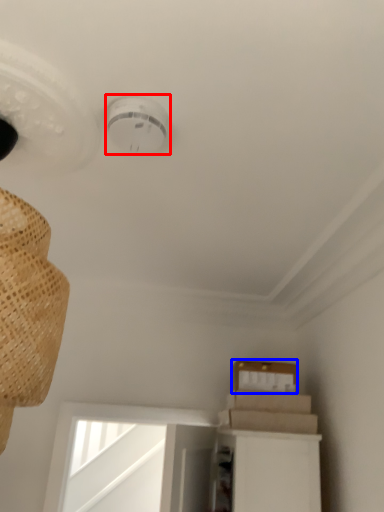
Question: Among these objects, which one is nearest to the camera, lamp (highlighted by a red box) or cardboard box (highlighted by a blue box)?

Choices:
 (A) lamp
 (B) cardboard box

Answer: (A)